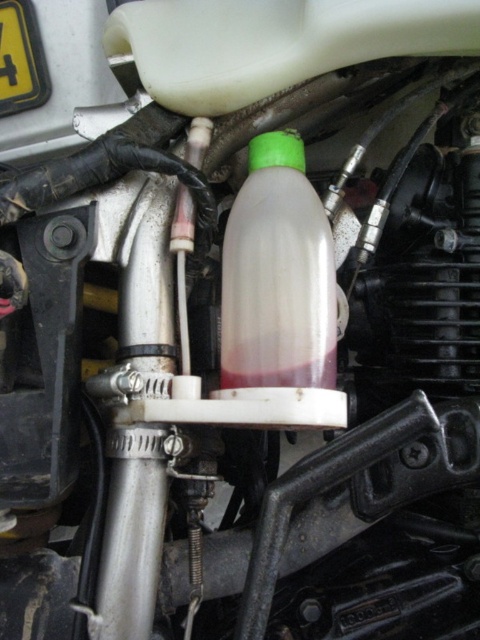
You are a mechanic inspecting the motorcycle engine. You notice two points marked in the engine bay. The first point is at coordinate point (237, 284) and the second is at point (7, 65). Which point is nearer to your current viewpoint as you look at the engine?

Point (237, 284) is closer to the camera than point (7, 65), so the first point is nearer to your viewpoint.

You are a mechanic working on a motorcycle. You need to determine if the translucent plastic bottle at center can be stored under the yellow plastic license plate at upper left. Based on their sizes, will it fit?

The translucent plastic bottle at center is larger in size than the yellow plastic license plate at upper left, so it will not fit under the license plate.